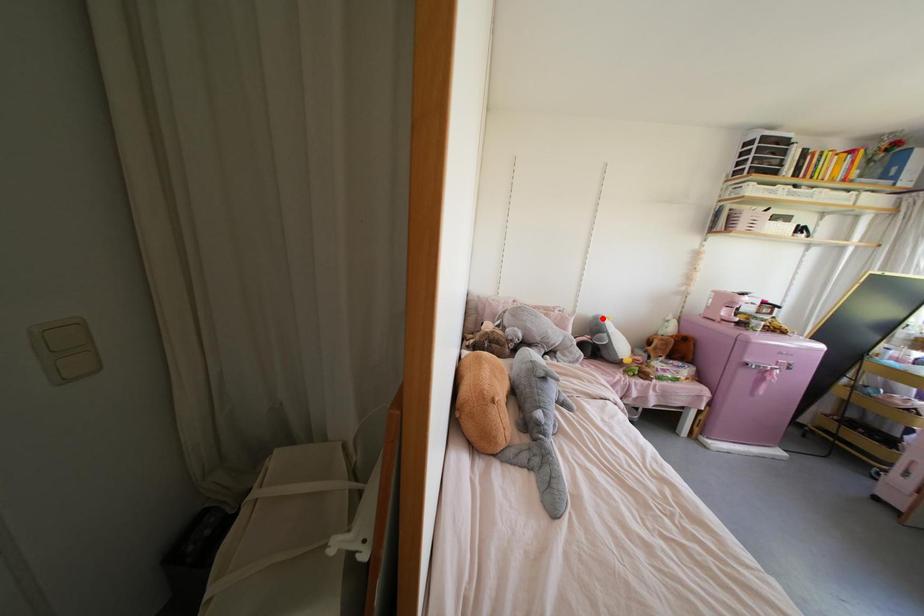
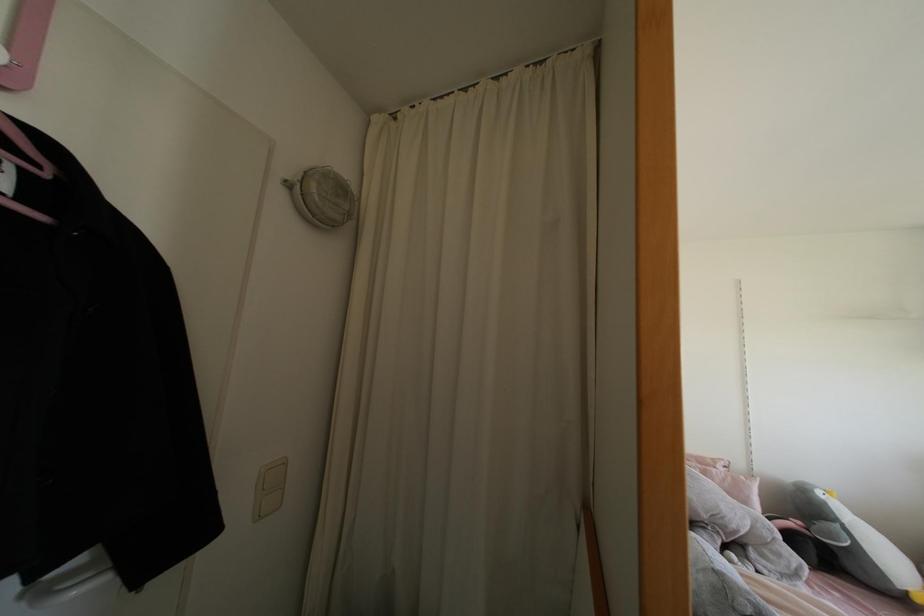
In the second image, find the point that corresponds to the highlighted location in the first image.

(819, 493)